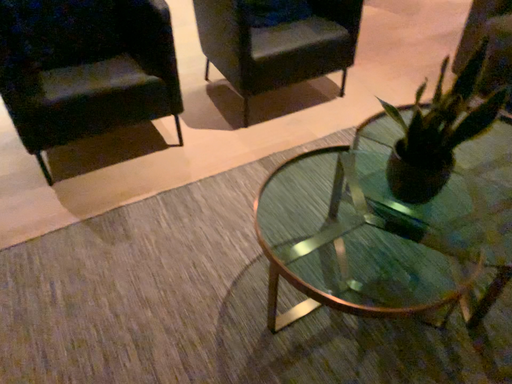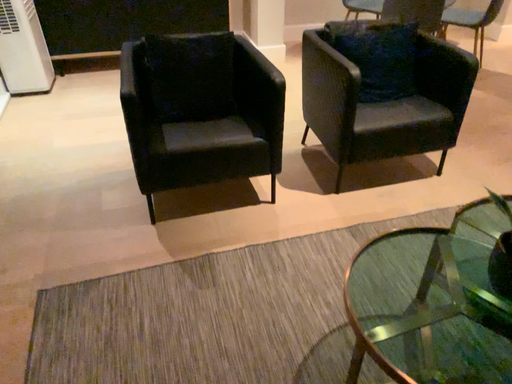
Question: How did the camera likely rotate when shooting the video?

Choices:
 (A) rotated downward
 (B) rotated upward

Answer: (B)